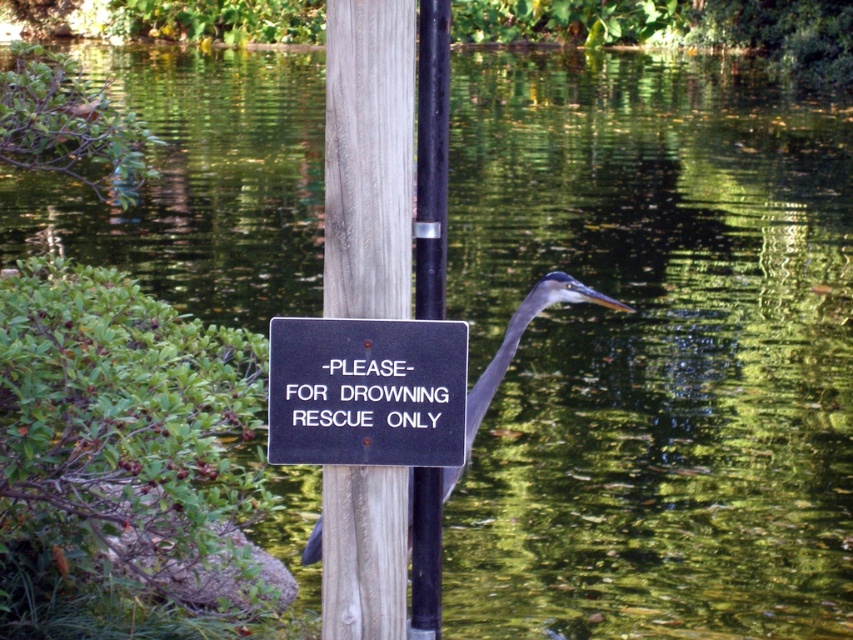
Does black plastic sign at center have a greater height compared to gray matte heron at center?

No.

Does black plastic sign at center have a greater width compared to gray matte heron at center?

No.

Find the location of a particular element. The height and width of the screenshot is (640, 853). black plastic sign at center is located at coordinates (366, 392).

Where is `black plastic sign at center`? The width and height of the screenshot is (853, 640). black plastic sign at center is located at coordinates (x=366, y=392).

Measure the distance between point (x=416, y=120) and camera.

The distance of point (x=416, y=120) from camera is 7.16 feet.

Is point (439, 140) more distant than point (320, 534)?

No, (439, 140) is closer to viewer.

Find the location of `black wood pole at center`. black wood pole at center is located at coordinates (431, 157).

Is wooden post at center thinner than black plastic sign at center?

Yes, wooden post at center is thinner than black plastic sign at center.

Does point (369, 100) lie behind point (457, 452)?

No.

Where is `wooden post at center`? The width and height of the screenshot is (853, 640). wooden post at center is located at coordinates (368, 157).